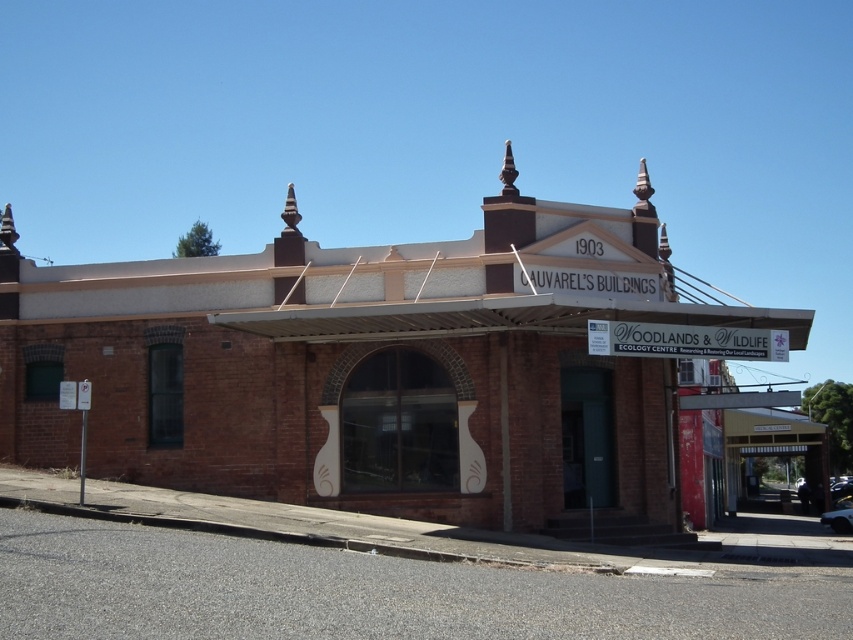
You are a visitor standing in front of the brown brick building at center and the brown wooden canopy at lower right. Which structure is wider?

The brown brick building at center is wider than the brown wooden canopy at lower right.

You are standing in front of a historical building and notice a specific point marked at coordinates (381, 368). What does this point indicate?

The point at coordinates (381, 368) marks the brown brick building at center.

You are standing in front of the brick building and notice two points marked on its facade. The first point is at coordinates point (740, 324) and the second is at point (805, 477). Which of these points is closer to you?

Point (740, 324) is in front of point (805, 477), so the first point is closer to you.